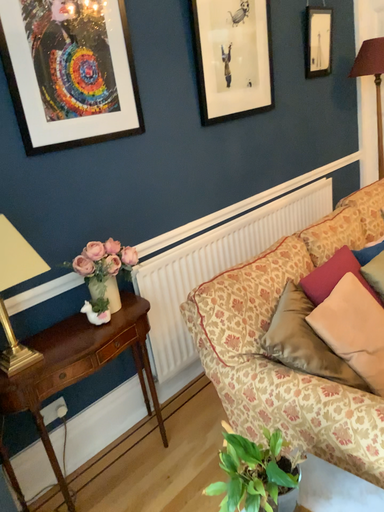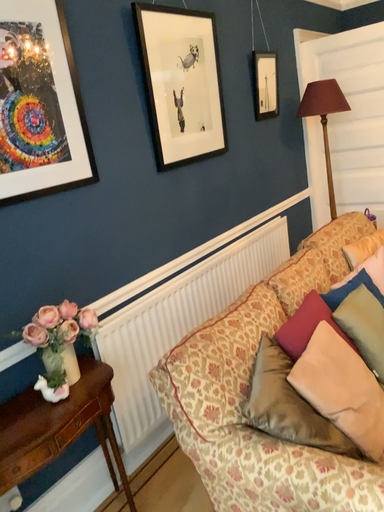
Question: Which way did the camera rotate in the video?

Choices:
 (A) rotated right
 (B) rotated left

Answer: (A)